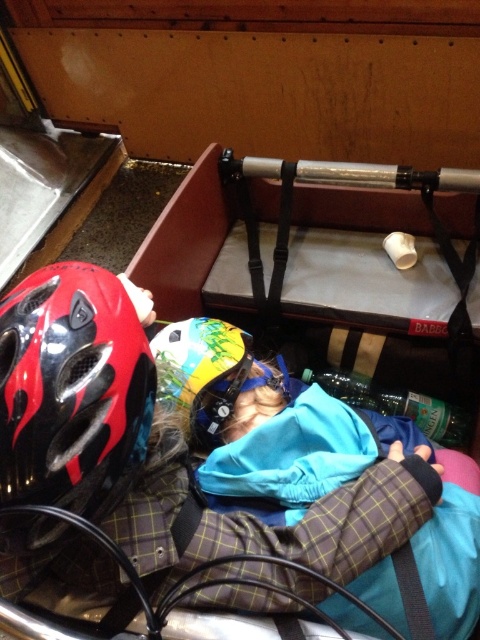
You are a passenger on a train and see two children lying down in a compartment. The first child has a red and black flame patterned helmet, and the second child is partially covered by a blue jacket with a yellow helmet that has green and blue designs. There is also a plaid fabric sleeping bag at center. Which object is located at the coordinate point (264, 424)?

The plaid fabric sleeping bag at center is located at the coordinate point (264, 424).

You are a passenger on a bus and need to find the plaid fabric sleeping bag at center. Based on the coordinates provided in the scene description, can you determine its exact position relative to the two children?

The plaid fabric sleeping bag at center is located at coordinates point (264,424), which places it centrally within the scene, likely between or near the two children mentioned in the foreground.

You are a safety inspector checking the storage area of a public transport vehicle. You notice the shiny red helmet at left and the multicolored glossy helmet at center. Which helmet takes up more space in the storage area?

The shiny red helmet at left has a larger size compared to the multicolored glossy helmet at center, so it takes up more space in the storage area.